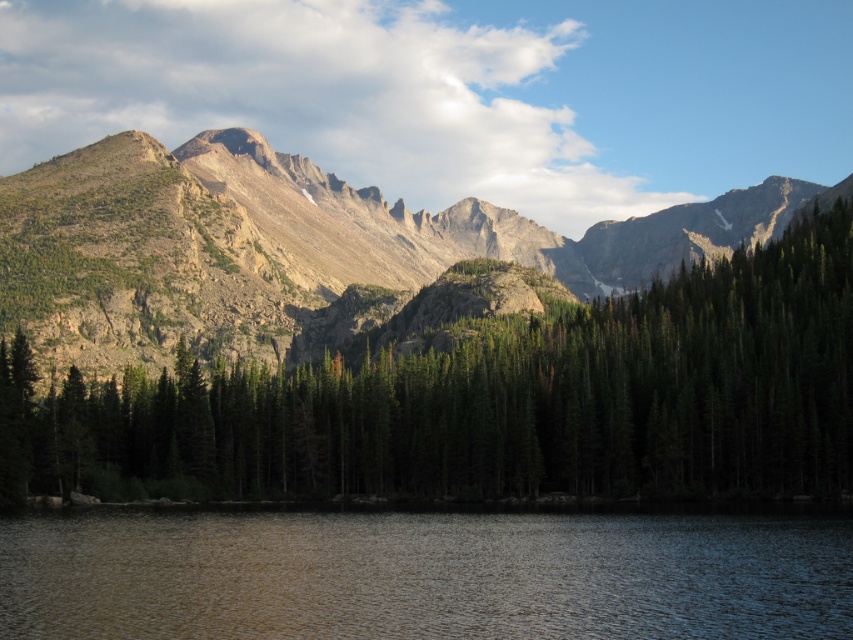
You are standing at the base of the mountains and see two points marked in the image. Which point, point (517, 426) or point (451, 525), is closer to you?

Point (517, 426) is further to the viewer than point (451, 525), so the closer point to you is point (451, 525).